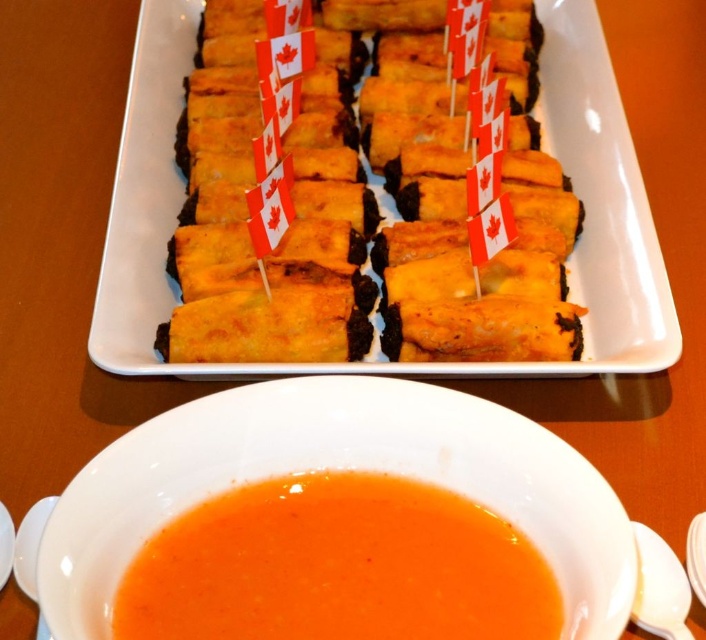
You are a guest at a Canada Day party and want to reach for the white ceramic bowl at center. If your hand is 24 inches long, can you comfortably reach it without moving your chair?

The white ceramic bowl at center is 23.79 inches away from the viewer. Since your hand is 24 inches long, you can comfortably reach it without moving your chair.

From the picture: You are a guest at a Canada Day party and see the golden crispy spring rolls at center and the white ceramic bowl at center on the table. Which item takes up more space on the table?

The golden crispy spring rolls at center takes up more space on the table since it has a larger size compared to the white ceramic bowl at center.